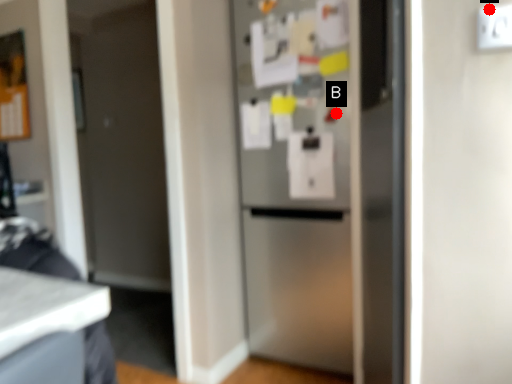
Question: Two points are circled on the image, labeled by A and B beside each circle. Which point is farther to the camera?

Choices:
 (A) A is further
 (B) B is further

Answer: (B)